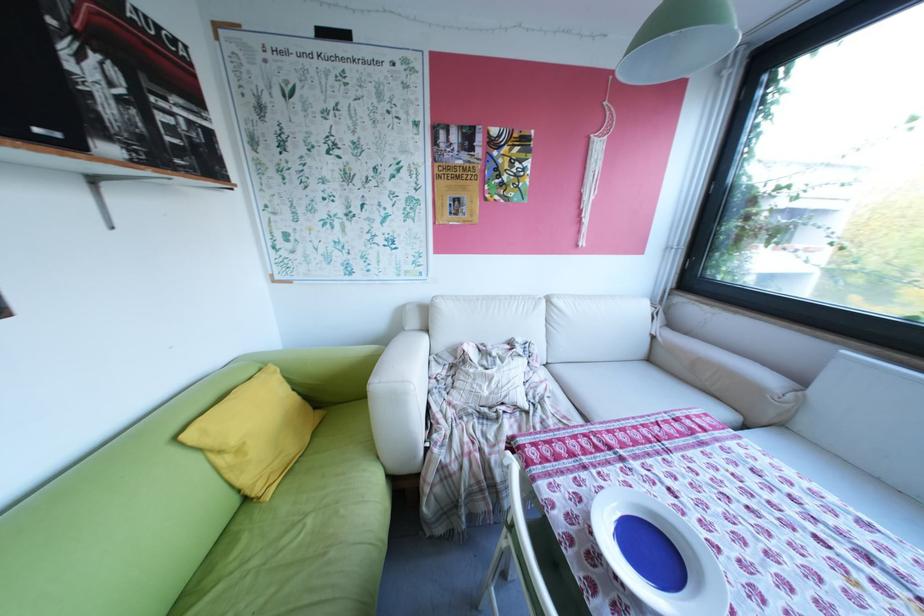
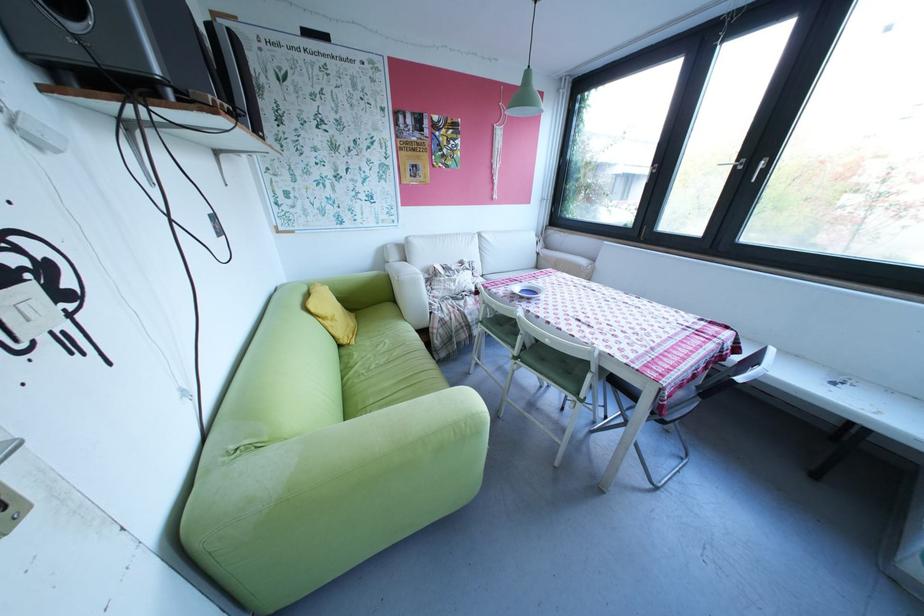
Locate, in the second image, the point that corresponds to [237,460] in the first image.

(339, 323)